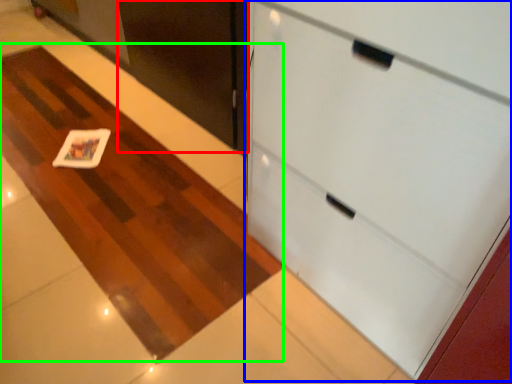
Question: Estimate the real-world distances between objects in this image. Which object is closer to door (highlighted by a red box), cabinetry (highlighted by a blue box) or plain (highlighted by a green box)?

Choices:
 (A) cabinetry
 (B) plain

Answer: (B)